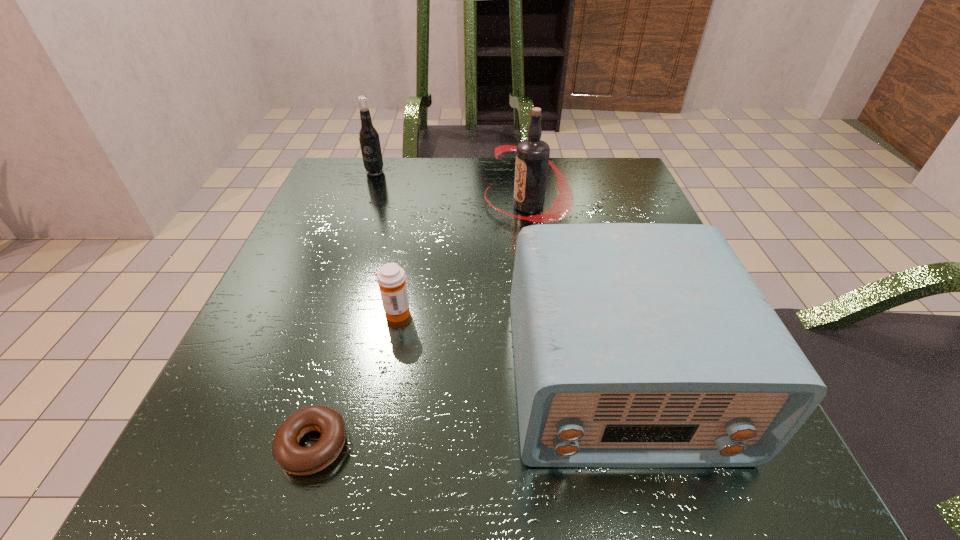
Locate an element on the screen. Image resolution: width=960 pixels, height=540 pixels. free space located 0.150m on the label of the taller root beer is located at coordinates (415, 206).

This screenshot has width=960, height=540. I want to click on vacant space situated 0.090m on the label of the farther root beer, so click(x=366, y=196).

You are a GUI agent. You are given a task and a screenshot of the screen. Output one action in this format:
    pyautogui.click(x=<x>, y=<y>)
    Task: Click on the free region located 0.090m on the front of the medicine
    Image resolution: width=960 pixels, height=540 pixels.
    Given the screenshot: What is the action you would take?
    pyautogui.click(x=385, y=370)

Find the location of a particular element. vacant space situated 0.400m on the back of the shortest object is located at coordinates (376, 234).

Image resolution: width=960 pixels, height=540 pixels. In order to click on radio receiver that is at the near edge in this screenshot , I will do `click(636, 345)`.

The image size is (960, 540). Find the location of `doughnut located in the near edge section of the desktop`. doughnut located in the near edge section of the desktop is located at coordinates (288, 454).

Image resolution: width=960 pixels, height=540 pixels. Identify the location of root beer positioned at the left edge. (369, 140).

Locate an element on the screen. doughnut located at the left edge is located at coordinates (288, 454).

Where is `object located at the right edge`? object located at the right edge is located at coordinates (636, 345).

Find the location of `object situated at the far left corner`. object situated at the far left corner is located at coordinates (369, 140).